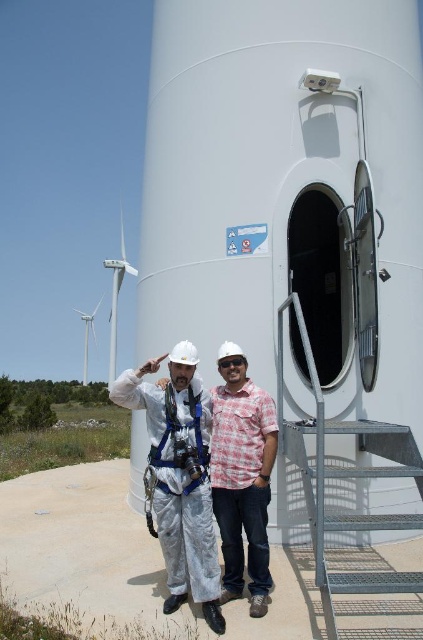
Is plaid shirt at center below white matte windmill at upper left?

Indeed, plaid shirt at center is positioned under white matte windmill at upper left.

Describe the element at coordinates (241, 476) in the screenshot. The image size is (423, 640). I see `plaid shirt at center` at that location.

Who is more forward, (217,440) or (118,273)?

Positioned in front is point (217,440).

Identify the location of plaid shirt at center. The image size is (423, 640). (241, 476).

Does white matte/soft fabric couple at center have a greater height compared to white matte windmill at left?

Incorrect, white matte/soft fabric couple at center's height is not larger of white matte windmill at left's.

The image size is (423, 640). Find the location of `white matte/soft fabric couple at center`. white matte/soft fabric couple at center is located at coordinates (178, 476).

Identify the location of white matte/soft fabric couple at center. (178, 476).

Between white matte windmill at upper left and white matte windmill at left, which one appears on the right side from the viewer's perspective?

white matte windmill at upper left is more to the right.

Is white matte windmill at upper left bigger than white matte windmill at left?

Yes.

Does point (120, 225) come farther from viewer compared to point (85, 342)?

That is False.

You are a GUI agent. You are given a task and a screenshot of the screen. Output one action in this format:
    pyautogui.click(x=<x>, y=<y>)
    Task: Click on the white matte windmill at upper left
    Image resolution: width=423 pixels, height=640 pixels.
    Given the screenshot: What is the action you would take?
    pyautogui.click(x=117, y=294)